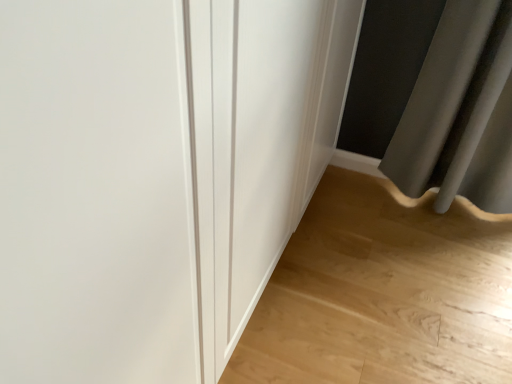
The width and height of the screenshot is (512, 384). Describe the element at coordinates (383, 293) in the screenshot. I see `light wood floor at lower right` at that location.

You are a GUI agent. You are given a task and a screenshot of the screen. Output one action in this format:
    pyautogui.click(x=<x>, y=<y>)
    Task: Click on the light wood floor at lower right
    
    Given the screenshot: What is the action you would take?
    pyautogui.click(x=383, y=293)

The image size is (512, 384). Describe the element at coordinates (156, 175) in the screenshot. I see `white smooth door at center` at that location.

The height and width of the screenshot is (384, 512). Identify the location of white smooth door at center. (156, 175).

I want to click on light wood floor at lower right, so click(383, 293).

Considering the positions of objects white smooth door at center and light wood floor at lower right in the image provided, who is more to the left, white smooth door at center or light wood floor at lower right?

white smooth door at center is more to the left.

Is white smooth door at center in front of light wood floor at lower right?

Yes, it is in front of light wood floor at lower right.

Between point (125, 157) and point (437, 286), which one is positioned in front?

Point (125, 157)

From the image's perspective, which one is positioned higher, white smooth door at center or light wood floor at lower right?

white smooth door at center, from the image's perspective.

From a real-world perspective, is white smooth door at center over light wood floor at lower right?

Yes.

Which object is wider, white smooth door at center or light wood floor at lower right?

Wider between the two is light wood floor at lower right.

From their relative heights in the image, would you say white smooth door at center is taller or shorter than light wood floor at lower right?

Considering their sizes, white smooth door at center has more height than light wood floor at lower right.

Based on the photo, considering the sizes of white smooth door at center and light wood floor at lower right in the image, is white smooth door at center bigger or smaller than light wood floor at lower right?

Clearly, white smooth door at center is larger in size than light wood floor at lower right.

From the picture: Would you say white smooth door at center is inside or outside light wood floor at lower right?

white smooth door at center lies outside light wood floor at lower right.

Is white smooth door at center in contact with light wood floor at lower right?

They are not placed beside each other.

Is white smooth door at center oriented away from light wood floor at lower right?

white smooth door at center does not have its back to light wood floor at lower right.

At what (x,y) coordinates should I click in order to perform the action: click on corridor to the right of white smooth door at center. Please return your answer as a coordinate pair (x, y). Looking at the image, I should click on (383, 293).

Which object is positioned more to the left, light wood floor at lower right or white smooth door at center?

white smooth door at center.

Is light wood floor at lower right further to camera compared to white smooth door at center?

Yes.

Considering the positions of point (239, 381) and point (88, 302), is point (239, 381) closer or farther from the camera than point (88, 302)?

Clearly, point (239, 381) is more distant from the camera than point (88, 302).

From the image's perspective, is light wood floor at lower right positioned above or below white smooth door at center?

From the image's perspective, light wood floor at lower right appears below white smooth door at center.

From a real-world perspective, which object stands above the other?

white smooth door at center, from a real-world perspective.

Does light wood floor at lower right have a greater width compared to white smooth door at center?

Correct, the width of light wood floor at lower right exceeds that of white smooth door at center.

Between light wood floor at lower right and white smooth door at center, which one has more height?

Standing taller between the two is white smooth door at center.

Considering the relative sizes of light wood floor at lower right and white smooth door at center in the image provided, is light wood floor at lower right smaller than white smooth door at center?

Indeed, light wood floor at lower right has a smaller size compared to white smooth door at center.

Does light wood floor at lower right contain white smooth door at center?

No, light wood floor at lower right does not contain white smooth door at center.

Looking at this image, is light wood floor at lower right far away from white smooth door at center?

light wood floor at lower right is actually quite close to white smooth door at center.

Is light wood floor at lower right oriented away from white smooth door at center?

No.

Can you tell me how much light wood floor at lower right and white smooth door at center differ in facing direction?

They differ by 90.4 degrees in their facing directions.

Find the location of a particular element. This screenshot has width=512, height=384. door above the light wood floor at lower right (from a real-world perspective) is located at coordinates (156, 175).

Locate an element on the screen. door that is above the light wood floor at lower right (from the image's perspective) is located at coordinates (156, 175).

Find the location of a particular element. This screenshot has width=512, height=384. door above the light wood floor at lower right (from a real-world perspective) is located at coordinates (156, 175).